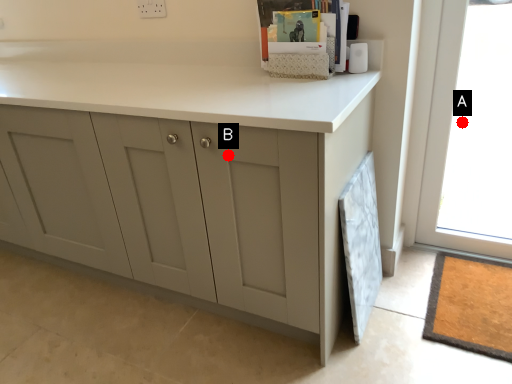
Question: Two points are circled on the image, labeled by A and B beside each circle. Which point appears closest to the camera in this image?

Choices:
 (A) A is closer
 (B) B is closer

Answer: (B)